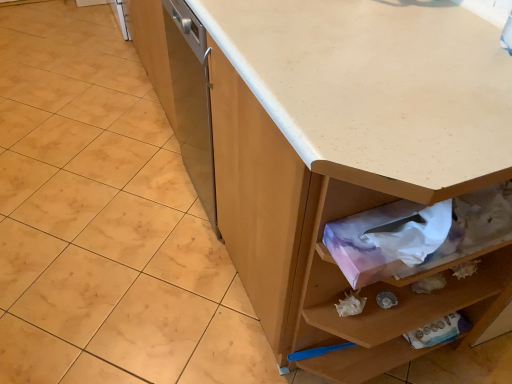
Identify the location of blank space situated above white matte granite at center (from a real-world perspective). (130, 173).